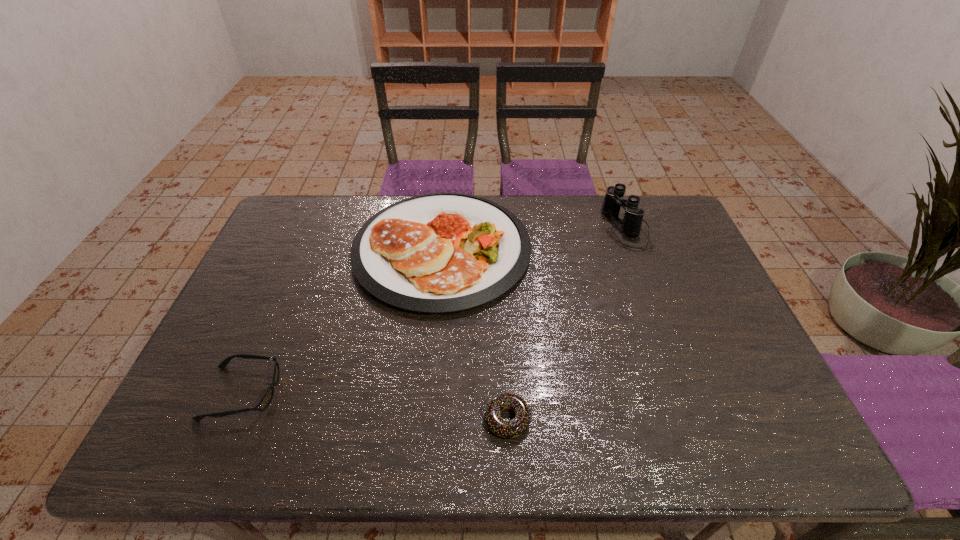
This screenshot has width=960, height=540. I want to click on the third closest object to the dish, so click(x=631, y=224).

Find the location of a particular element. Image resolution: width=960 pixels, height=540 pixels. the closest object to the dish is located at coordinates (268, 396).

Image resolution: width=960 pixels, height=540 pixels. I want to click on free spot that satisfies the following two spatial constraints: 1. on the front-facing side of the leftmost object; 2. on the right side of the doughnut, so click(231, 419).

Identify the location of free spot that satisfies the following two spatial constraints: 1. on the front-facing side of the shortest object; 2. on the right side of the third tallest object. (231, 419).